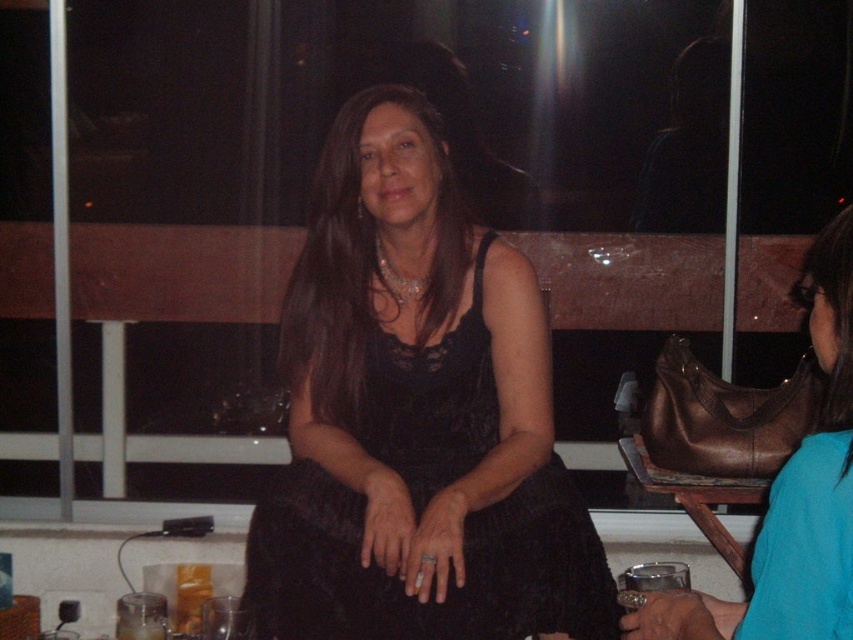
Question: Can you confirm if metallic brown purse at right is bigger than clear glass wine glass at lower center?

Choices:
 (A) no
 (B) yes

Answer: (B)

Question: Where is metallic brown purse at right located in relation to transparent glass at lower right in the image?

Choices:
 (A) left
 (B) right

Answer: (A)

Question: Based on their relative distances, which object is farther from the metallic brown purse at right?

Choices:
 (A) black lace dress at center
 (B) transparent glass at lower right
 (C) clear glass wine glass at lower center

Answer: (C)

Question: Which is nearer to the clear glass wine glass at lower center?

Choices:
 (A) transparent glass at lower right
 (B) black lace dress at center
 (C) metallic brown purse at right

Answer: (B)

Question: Which object appears farthest from the camera in this image?

Choices:
 (A) transparent glass at lower right
 (B) metallic brown purse at right
 (C) black lace dress at center
 (D) clear glass wine glass at lower center

Answer: (D)

Question: Is black lace dress at center further to the viewer compared to clear glass wine glass at lower center?

Choices:
 (A) yes
 (B) no

Answer: (B)